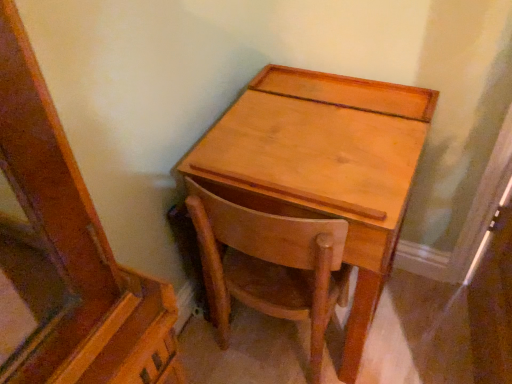
The height and width of the screenshot is (384, 512). What are the coordinates of `free spot above light brown wood desk at center (from a real-world perspective)` in the screenshot? It's located at (334, 106).